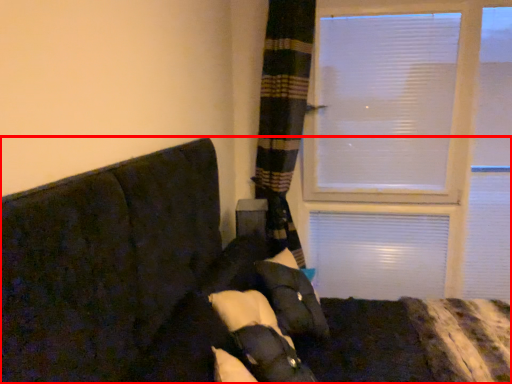
Question: From the image, what is the correct spatial relationship of furniture (annotated by the red box) in relation to pillow?

Choices:
 (A) right
 (B) left

Answer: (A)